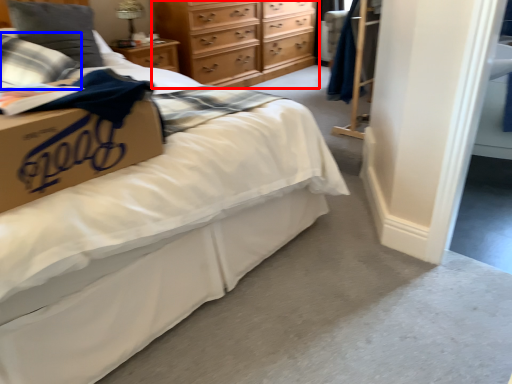
Question: Which point is closer to the camera, chest of drawers (highlighted by a red box) or pillow (highlighted by a blue box)?

Choices:
 (A) chest of drawers
 (B) pillow

Answer: (B)